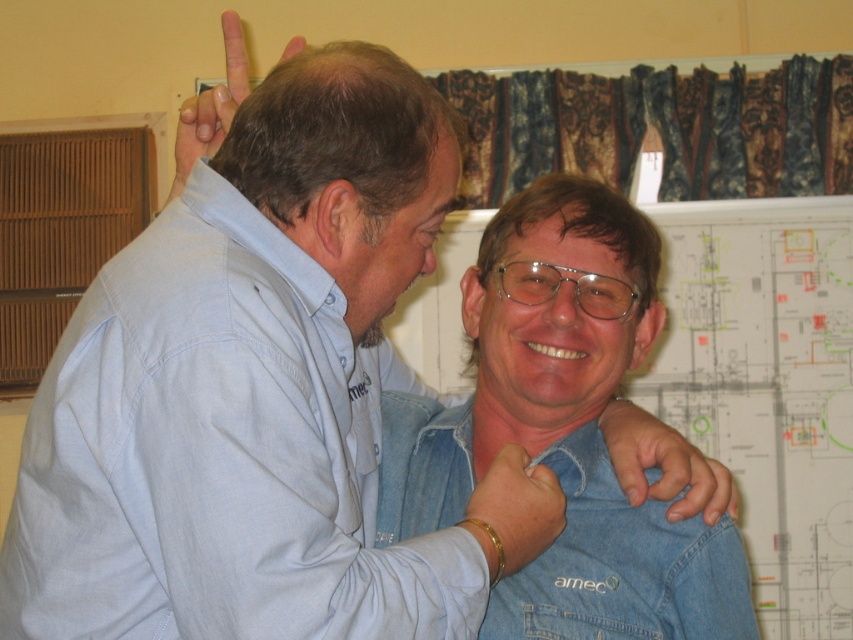
You are an observer in the scene. You notice two objects in the image. One is a gold bracelet at center and the other is matte skin at upper center. Which object is positioned higher in the image?

The matte skin at upper center is positioned higher than the gold bracelet at center.

You are a designer working on a virtual reality simulation of this scene. You need to ensure that the smooth denim hand at center and the matte skin at upper center are positioned correctly relative to each other. Based on the scene description, which object should be placed lower in the virtual environment?

The smooth denim hand at center should be placed lower in the virtual environment since it has a lesser height compared to the matte skin at upper center.

You are an observer in the scene. You notice two objects in the image, the smooth denim hand at center and the matte skin at upper center. Which object is positioned lower in the image?

The smooth denim hand at center is located below matte skin at upper center, so it is positioned lower in the image.